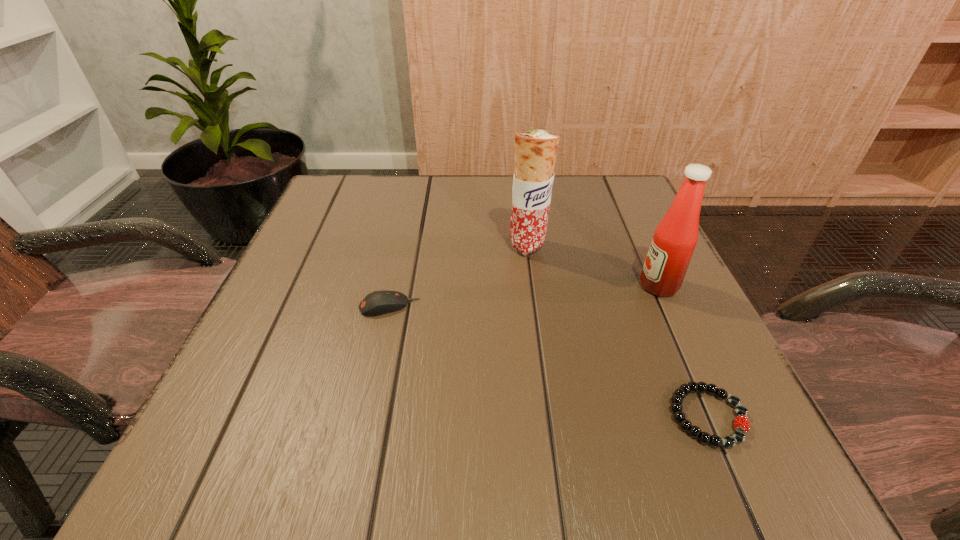
The height and width of the screenshot is (540, 960). I want to click on the second object from left to right, so click(535, 151).

You are a GUI agent. You are given a task and a screenshot of the screen. Output one action in this format:
    pyautogui.click(x=<x>, y=<y>)
    Task: Click on the farthest object
    The width and height of the screenshot is (960, 540).
    Given the screenshot: What is the action you would take?
    pyautogui.click(x=535, y=151)

Find the location of a particular element. The height and width of the screenshot is (540, 960). condiment is located at coordinates (675, 238).

The width and height of the screenshot is (960, 540). I want to click on computer mouse, so click(376, 303).

Find the location of a particular element. the second shortest object is located at coordinates (376, 303).

This screenshot has width=960, height=540. I want to click on the shortest object, so click(x=741, y=411).

Identify the location of the nearest object. (741, 411).

At what (x,y) coordinates should I click in order to perform the action: click on vacant space located 0.050m on the left of the burrito. Please return your answer as a coordinate pair (x, y). The image size is (960, 540). Looking at the image, I should click on (485, 246).

The height and width of the screenshot is (540, 960). What are the coordinates of `vacant space located 0.120m on the front-facing side of the condiment` in the screenshot? It's located at (576, 286).

Where is `vacant space located on the front-facing side of the condiment`? vacant space located on the front-facing side of the condiment is located at coordinates (430, 286).